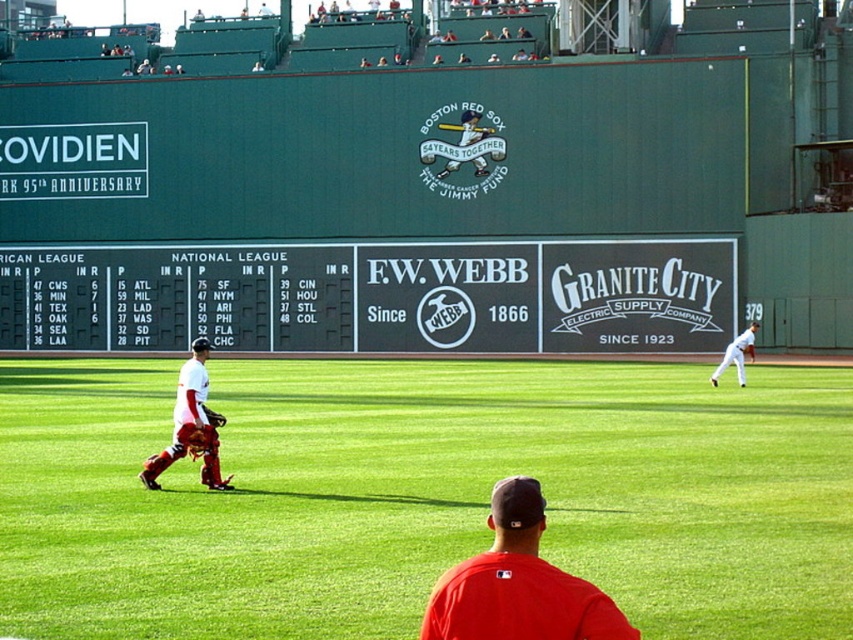
You are a photographer at Fenway Park capturing the scoreboard and the baseball memorabilia. You need to ensure that both the red matte baseball cap at center and the brown leather glove at left are visible in your shot. Based on their positions, which object should you adjust your camera angle to focus on first to include both in the frame?

The red matte baseball cap at center is above the brown leather glove at left. To include both in the frame, you should first focus on the red matte baseball cap at center since it is higher up, then adjust the angle downward to include the brown leather glove at left.

You are a photographer at Fenway Park and need to capture both the red matte baseball cap at center and the brown leather glove at left in your shot. Given that your camera has a fixed focal length and limited depth of field, which object should you focus on to ensure the larger object remains sharp?

The red matte baseball cap at center is bigger than the brown leather glove at left, so you should focus on the red matte baseball cap at center to ensure it remains sharp since it occupies more of the frame.